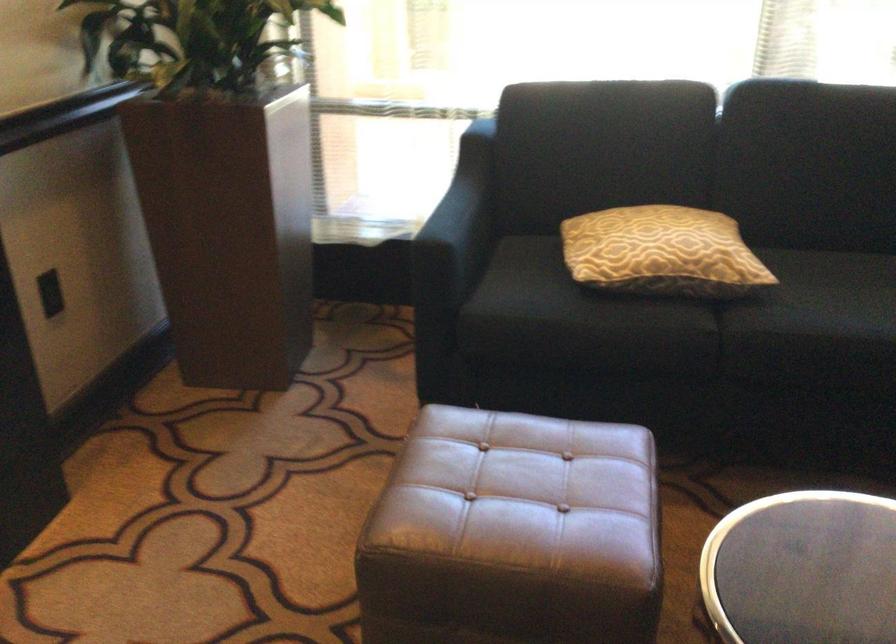
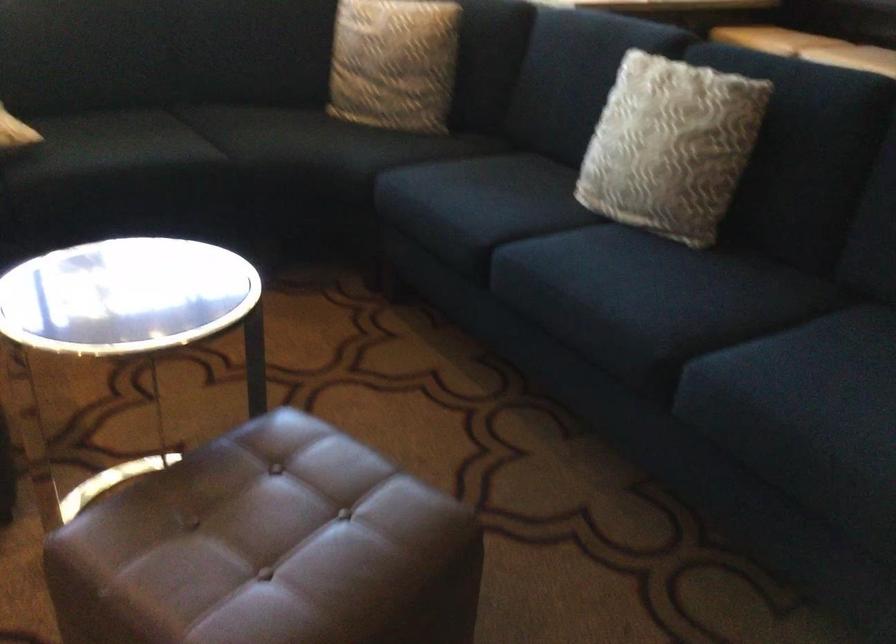
Question: How did the camera likely rotate?

Choices:
 (A) Left
 (B) Right
 (C) Up
 (D) Down

Answer: (B)